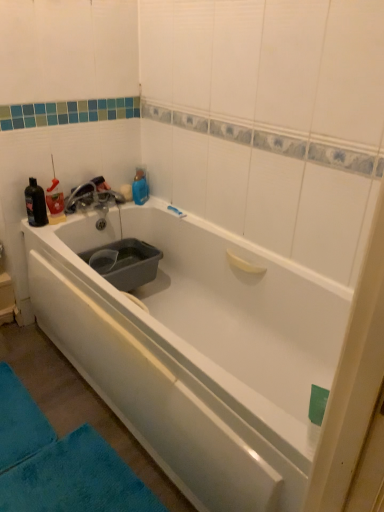
The width and height of the screenshot is (384, 512). Describe the element at coordinates (55, 201) in the screenshot. I see `translucent plastic bottle at upper left, which ranks as the first bottle in right-to-left order` at that location.

You are a GUI agent. You are given a task and a screenshot of the screen. Output one action in this format:
    pyautogui.click(x=<x>, y=<y>)
    Task: Click on the blue plush bath mat at lower left, the first bath mat viewed from the right
    The image size is (384, 512).
    Given the screenshot: What is the action you would take?
    pyautogui.click(x=75, y=479)

I want to click on white glossy bathtub at center, so click(197, 350).

At what (x,y) coordinates should I click in order to perform the action: click on gray plastic basin at left. Please return your answer as a coordinate pair (x, y). Looking at the image, I should click on (125, 262).

What is the approximate height of gray plastic basin at left?

It is 6.66 inches.

At what (x,y) coordinates should I click in order to perform the action: click on translucent plastic bottle at upper left, which ranks as the first bottle in right-to-left order. Please return your answer as a coordinate pair (x, y). This screenshot has height=512, width=384. Looking at the image, I should click on (55, 201).

From the image's perspective, which object appears higher, translucent plastic bottle at upper left, which ranks as the first bottle in right-to-left order, or white glossy bathtub at center?

translucent plastic bottle at upper left, which ranks as the first bottle in right-to-left order.

Is translucent plastic bottle at upper left, arranged as the second bottle when viewed from the left, bigger or smaller than white glossy bathtub at center?

In the image, translucent plastic bottle at upper left, arranged as the second bottle when viewed from the left, appears to be smaller than white glossy bathtub at center.

From a real-world perspective, relative to white glossy bathtub at center, is translucent plastic bottle at upper left, which ranks as the first bottle in right-to-left order, vertically above or below?

translucent plastic bottle at upper left, which ranks as the first bottle in right-to-left order, is situated higher than white glossy bathtub at center in the real world.

Is matte silver faucet at upper left located outside blue plush bath mat at lower left, marked as the 2th bath mat in a left-to-right arrangement?

Absolutely, matte silver faucet at upper left is external to blue plush bath mat at lower left, marked as the 2th bath mat in a left-to-right arrangement.

From the image's perspective, is matte silver faucet at upper left beneath blue plush bath mat at lower left, marked as the 2th bath mat in a left-to-right arrangement?

No.

Is matte silver faucet at upper left to the left or to the right of blue plush bath mat at lower left, marked as the 2th bath mat in a left-to-right arrangement, in the image?

In the image, matte silver faucet at upper left appears on the left side of blue plush bath mat at lower left, marked as the 2th bath mat in a left-to-right arrangement.

Measure the distance from black matte bottle at upper left, placed as the 1th bottle when sorted from left to right, to translucent plastic bottle at upper left, arranged as the second bottle when viewed from the left.

black matte bottle at upper left, placed as the 1th bottle when sorted from left to right, and translucent plastic bottle at upper left, arranged as the second bottle when viewed from the left, are 7.70 centimeters apart from each other.

How different are the orientations of black matte bottle at upper left, placed as the 1th bottle when sorted from left to right, and translucent plastic bottle at upper left, which ranks as the first bottle in right-to-left order, in degrees?

The facing directions of black matte bottle at upper left, placed as the 1th bottle when sorted from left to right, and translucent plastic bottle at upper left, which ranks as the first bottle in right-to-left order, are 0.000809 degrees apart.

Based on the photo, who is shorter, black matte bottle at upper left, placed as the 1th bottle when sorted from left to right, or translucent plastic bottle at upper left, which ranks as the first bottle in right-to-left order?

Standing shorter between the two is translucent plastic bottle at upper left, which ranks as the first bottle in right-to-left order.

Looking at this image, are black matte bottle at upper left, placed as the 1th bottle when sorted from left to right, and translucent plastic bottle at upper left, arranged as the second bottle when viewed from the left, beside each other?

Absolutely, black matte bottle at upper left, placed as the 1th bottle when sorted from left to right, is next to and touching translucent plastic bottle at upper left, arranged as the second bottle when viewed from the left.

From the image's perspective, which object appears higher, blue soft bath mat at lower left, which is counted as the first bath mat, starting from the left, or black matte bottle at upper left, placed as the 1th bottle when sorted from left to right?

From the image's view, black matte bottle at upper left, placed as the 1th bottle when sorted from left to right, is above.

Considering the sizes of objects blue soft bath mat at lower left, placed as the second bath mat when sorted from right to left, and black matte bottle at upper left, positioned as the 2th bottle in right-to-left order, in the image provided, who is thinner, blue soft bath mat at lower left, placed as the second bath mat when sorted from right to left, or black matte bottle at upper left, positioned as the 2th bottle in right-to-left order,?

black matte bottle at upper left, positioned as the 2th bottle in right-to-left order, is thinner.

Is blue soft bath mat at lower left, placed as the second bath mat when sorted from right to left, positioned beyond the bounds of black matte bottle at upper left, placed as the 1th bottle when sorted from left to right?

Yes.

What's the angular difference between blue soft bath mat at lower left, which is counted as the first bath mat, starting from the left, and black matte bottle at upper left, positioned as the 2th bottle in right-to-left order,'s facing directions?

The angular difference between blue soft bath mat at lower left, which is counted as the first bath mat, starting from the left, and black matte bottle at upper left, positioned as the 2th bottle in right-to-left order, is 0.172 degrees.

Who is more distant, translucent plastic bottle at upper left, arranged as the second bottle when viewed from the left, or matte silver faucet at upper left?

matte silver faucet at upper left.

Do you think translucent plastic bottle at upper left, arranged as the second bottle when viewed from the left, is within matte silver faucet at upper left, or outside of it?

translucent plastic bottle at upper left, arranged as the second bottle when viewed from the left, is spatially situated outside matte silver faucet at upper left.

Which is in front, point (61, 217) or point (76, 203)?

Point (61, 217)

Considering the sizes of translucent plastic bottle at upper left, arranged as the second bottle when viewed from the left, and matte silver faucet at upper left in the image, is translucent plastic bottle at upper left, arranged as the second bottle when viewed from the left, bigger or smaller than matte silver faucet at upper left?

translucent plastic bottle at upper left, arranged as the second bottle when viewed from the left, is smaller than matte silver faucet at upper left.

Are blue plush bath mat at lower left, marked as the 2th bath mat in a left-to-right arrangement, and blue soft bath mat at lower left, which is counted as the first bath mat, starting from the left, located far from each other?

No, blue plush bath mat at lower left, marked as the 2th bath mat in a left-to-right arrangement, is in close proximity to blue soft bath mat at lower left, which is counted as the first bath mat, starting from the left.

Based on the photo, can you confirm if blue plush bath mat at lower left, the first bath mat viewed from the right, is positioned to the right of blue soft bath mat at lower left, placed as the second bath mat when sorted from right to left?

Yes, blue plush bath mat at lower left, the first bath mat viewed from the right, is to the right of blue soft bath mat at lower left, placed as the second bath mat when sorted from right to left.

Would you say blue plush bath mat at lower left, the first bath mat viewed from the right, contains blue soft bath mat at lower left, placed as the second bath mat when sorted from right to left?

Actually, blue soft bath mat at lower left, placed as the second bath mat when sorted from right to left, is outside blue plush bath mat at lower left, the first bath mat viewed from the right.

The width and height of the screenshot is (384, 512). In the image, there is a blue plush bath mat at lower left, the first bath mat viewed from the right. What are the coordinates of `bath mat below it (from a real-world perspective)` in the screenshot? It's located at (20, 422).

Considering the relative positions of white glossy bathtub at center and blue soft bath mat at lower left, which is counted as the first bath mat, starting from the left, in the image provided, is white glossy bathtub at center to the left of blue soft bath mat at lower left, which is counted as the first bath mat, starting from the left, from the viewer's perspective?

Incorrect, white glossy bathtub at center is not on the left side of blue soft bath mat at lower left, which is counted as the first bath mat, starting from the left.

Can you confirm if white glossy bathtub at center is shorter than blue soft bath mat at lower left, placed as the second bath mat when sorted from right to left?

Indeed, white glossy bathtub at center has a lesser height compared to blue soft bath mat at lower left, placed as the second bath mat when sorted from right to left.

Does white glossy bathtub at center come behind blue soft bath mat at lower left, placed as the second bath mat when sorted from right to left?

No, white glossy bathtub at center is in front of blue soft bath mat at lower left, placed as the second bath mat when sorted from right to left.

From the image's perspective, is white glossy bathtub at center on blue soft bath mat at lower left, placed as the second bath mat when sorted from right to left?

→ Indeed, from the image's perspective, white glossy bathtub at center is shown above blue soft bath mat at lower left, placed as the second bath mat when sorted from right to left.

Starting from the white glossy bathtub at center, which bottle is the 1st one to the left? Please provide its 2D coordinates.

[(55, 201)]

Image resolution: width=384 pixels, height=512 pixels. I want to click on tap above the blue plush bath mat at lower left, the first bath mat viewed from the right (from a real-world perspective), so click(92, 196).

Looking at the image, which one is located closer to translucent plastic bottle at upper left, which ranks as the first bottle in right-to-left order, gray plastic basin at left or blue plush bath mat at lower left, the first bath mat viewed from the right?

Based on the image, gray plastic basin at left appears to be nearer to translucent plastic bottle at upper left, which ranks as the first bottle in right-to-left order.

From the image, which object appears to be nearer to black matte bottle at upper left, positioned as the 2th bottle in right-to-left order, blue soft bath mat at lower left, placed as the second bath mat when sorted from right to left, or white glossy bathtub at center?

white glossy bathtub at center is closer to black matte bottle at upper left, positioned as the 2th bottle in right-to-left order.

Looking at the image, which one is located further to matte silver faucet at upper left, translucent plastic bottle at upper left, arranged as the second bottle when viewed from the left, or blue soft bath mat at lower left, placed as the second bath mat when sorted from right to left?

The object further to matte silver faucet at upper left is blue soft bath mat at lower left, placed as the second bath mat when sorted from right to left.

Estimate the real-world distances between objects in this image. Which object is further from black matte bottle at upper left, placed as the 1th bottle when sorted from left to right, blue plush bath mat at lower left, marked as the 2th bath mat in a left-to-right arrangement, or white glossy bathtub at center?

The object further to black matte bottle at upper left, placed as the 1th bottle when sorted from left to right, is blue plush bath mat at lower left, marked as the 2th bath mat in a left-to-right arrangement.

Looking at the image, which one is located further to black matte bottle at upper left, positioned as the 2th bottle in right-to-left order, blue soft bath mat at lower left, which is counted as the first bath mat, starting from the left, or gray plastic basin at left?

Among the two, blue soft bath mat at lower left, which is counted as the first bath mat, starting from the left, is located further to black matte bottle at upper left, positioned as the 2th bottle in right-to-left order.

Considering their positions, is blue soft bath mat at lower left, which is counted as the first bath mat, starting from the left, positioned closer to translucent plastic bottle at upper left, arranged as the second bottle when viewed from the left, than black matte bottle at upper left, placed as the 1th bottle when sorted from left to right?

Among the two, black matte bottle at upper left, placed as the 1th bottle when sorted from left to right, is located nearer to translucent plastic bottle at upper left, arranged as the second bottle when viewed from the left.

From the image, which object appears to be nearer to translucent plastic bottle at upper left, arranged as the second bottle when viewed from the left, black matte bottle at upper left, placed as the 1th bottle when sorted from left to right, or blue plush bath mat at lower left, marked as the 2th bath mat in a left-to-right arrangement?

black matte bottle at upper left, placed as the 1th bottle when sorted from left to right, is positioned closer to the anchor translucent plastic bottle at upper left, arranged as the second bottle when viewed from the left.

Looking at this image, from the image, which object appears to be nearer to white glossy bathtub at center, blue soft bath mat at lower left, placed as the second bath mat when sorted from right to left, or gray plastic basin at left?

gray plastic basin at left is closer to white glossy bathtub at center.

Where is `sink between translucent plastic bottle at upper left, which ranks as the first bottle in right-to-left order, and blue plush bath mat at lower left, the first bath mat viewed from the right, in the vertical direction`? Image resolution: width=384 pixels, height=512 pixels. sink between translucent plastic bottle at upper left, which ranks as the first bottle in right-to-left order, and blue plush bath mat at lower left, the first bath mat viewed from the right, in the vertical direction is located at coordinates (125, 262).

Locate an element on the screen. bath mat that lies between matte silver faucet at upper left and blue plush bath mat at lower left, marked as the 2th bath mat in a left-to-right arrangement, from top to bottom is located at coordinates (20, 422).

I want to click on bathtub that lies between matte silver faucet at upper left and blue soft bath mat at lower left, placed as the second bath mat when sorted from right to left, from top to bottom, so click(197, 350).

This screenshot has height=512, width=384. In order to click on bottle located between black matte bottle at upper left, positioned as the 2th bottle in right-to-left order, and gray plastic basin at left in the left-right direction in this screenshot , I will do coord(55,201).